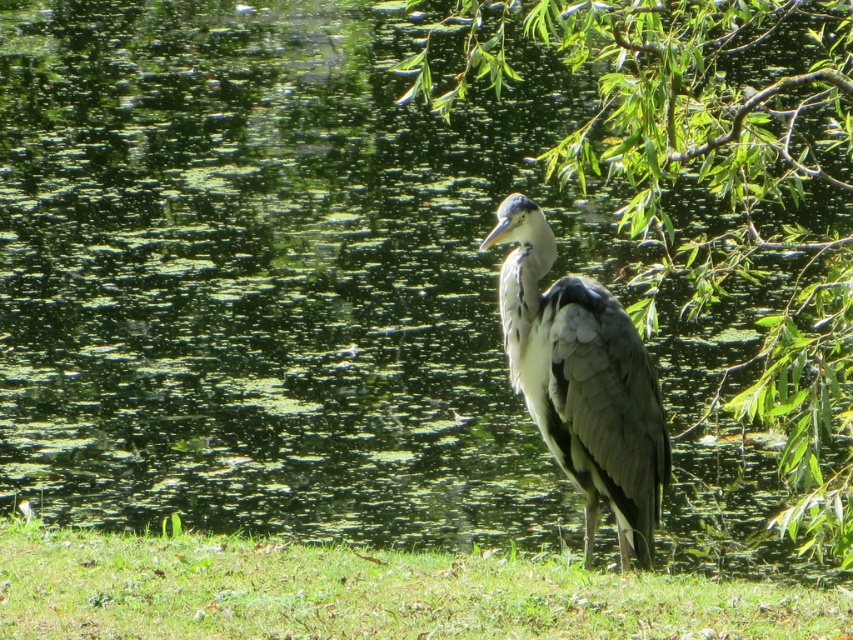
Is green leafy tree at center smaller than gray feathered heron at center?

No.

Locate an element on the screen. green leafy tree at center is located at coordinates (714, 192).

Which is behind, point (10, 560) or point (517, 307)?

Point (10, 560)

Does green grass at lower center come behind gray feathered heron at center?

No, it is not.

What do you see at coordinates (367, 593) in the screenshot?
I see `green grass at lower center` at bounding box center [367, 593].

The width and height of the screenshot is (853, 640). What are the coordinates of `green grass at lower center` in the screenshot? It's located at (367, 593).

Which is below, green leafy tree at center or green grass at lower center?

Positioned lower is green grass at lower center.

Measure the distance between green leafy tree at center and camera.

green leafy tree at center is 4.03 meters from camera.

Locate an element on the screen. The image size is (853, 640). green leafy tree at center is located at coordinates (714, 192).